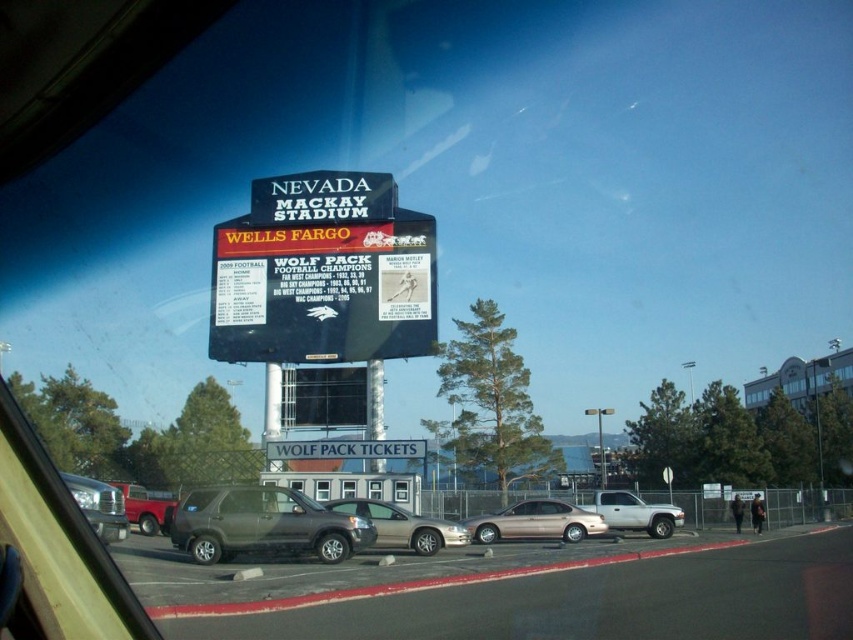
Looking at this image, you are a parking attendant and need to direct a visitor to park next to the gold metallic sedan at center. Which side of the metallic silver sedan at center should they park on?

The gold metallic sedan at center is to the right of the metallic silver sedan at center, so the visitor should park on the right side of the metallic silver sedan at center.

You are a delivery driver who needs to park your truck in the parking lot shown. You see the gold metallic sedan at center and the metallic pole at center. How far apart are these two objects?

The gold metallic sedan at center is 40.04 meters away from the metallic pole at center.

You are standing next to the camera and want to take a photo of the gold metallic sedan at center. Is the sedan within the recommended 100 meter range for optimal photo clarity?

The gold metallic sedan at center and camera are 102.61 meters apart from each other. Since the distance exceeds 100 meters, the sedan is slightly outside the recommended range for optimal photo clarity.